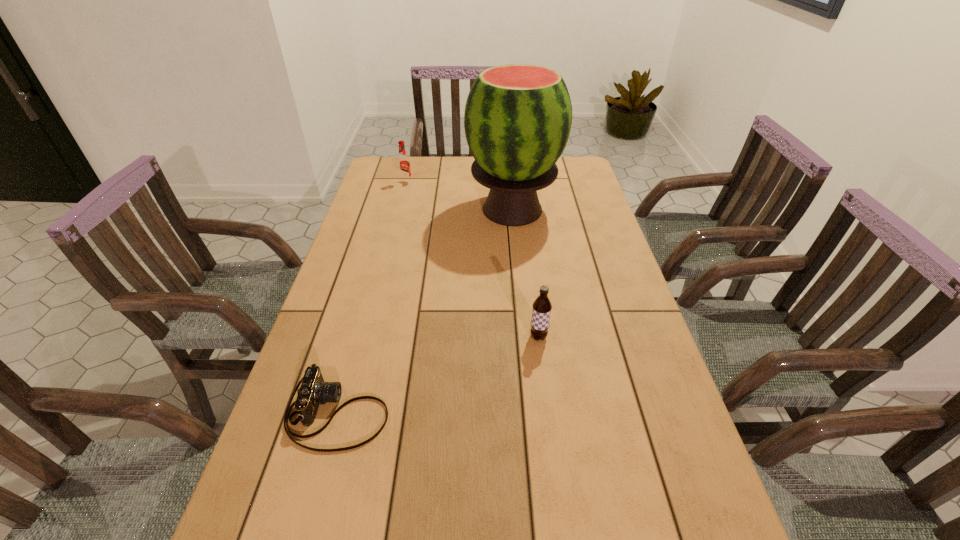
Where is `vacant space located on the front of the right root beer`? vacant space located on the front of the right root beer is located at coordinates (549, 421).

Locate an element on the screen. vacant space located 0.090m on the front-facing side of the shortest object is located at coordinates (431, 413).

Where is `object that is at the far edge`? The width and height of the screenshot is (960, 540). object that is at the far edge is located at coordinates (404, 169).

Image resolution: width=960 pixels, height=540 pixels. In order to click on root beer at the left edge in this screenshot , I will do `click(404, 169)`.

In order to click on camera present at the left edge in this screenshot , I will do `click(313, 391)`.

You are a GUI agent. You are given a task and a screenshot of the screen. Output one action in this format:
    pyautogui.click(x=<x>, y=<y>)
    Task: Click on the object present at the right edge
    Image resolution: width=960 pixels, height=540 pixels.
    Given the screenshot: What is the action you would take?
    tap(517, 120)

In order to click on object that is at the far left corner in this screenshot , I will do `click(404, 169)`.

At what (x,y) coordinates should I click in order to perform the action: click on vacant space at the far edge. Please return your answer as a coordinate pair (x, y). Looking at the image, I should click on (437, 165).

Where is `free space at the left edge of the desktop`? The height and width of the screenshot is (540, 960). free space at the left edge of the desktop is located at coordinates (363, 200).

I want to click on vacant space at the right edge of the desktop, so click(618, 294).